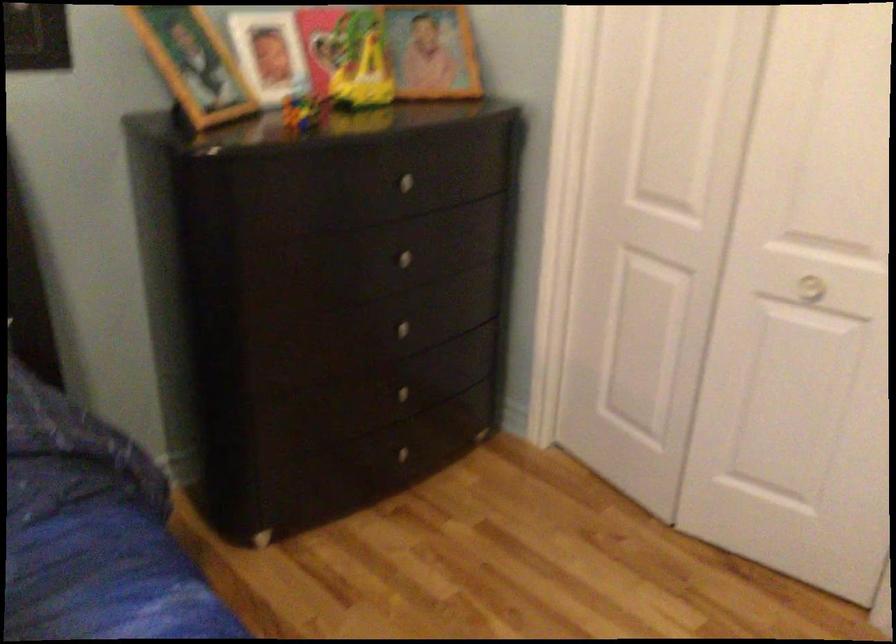
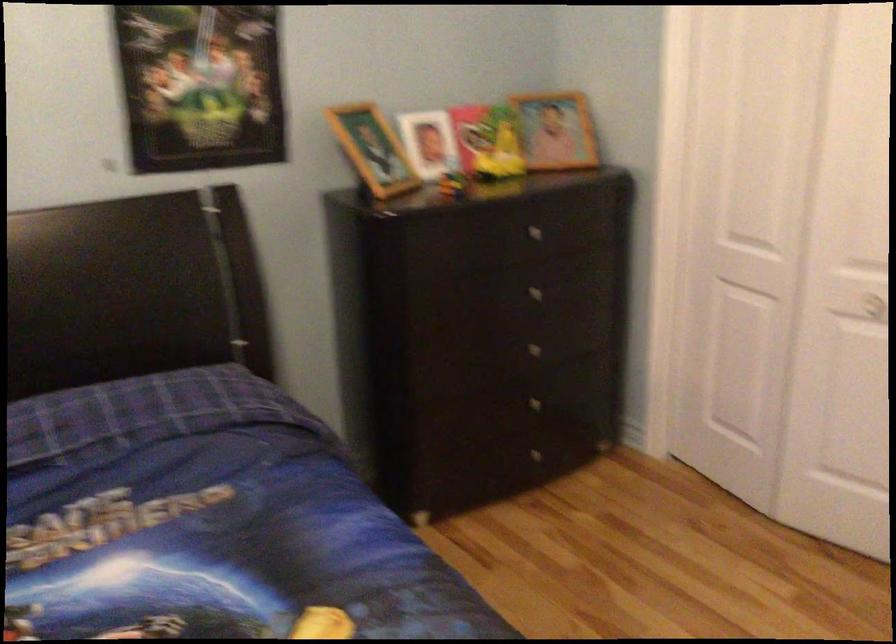
Where in the second image is the point corresponding to (195,67) from the first image?

(373, 149)